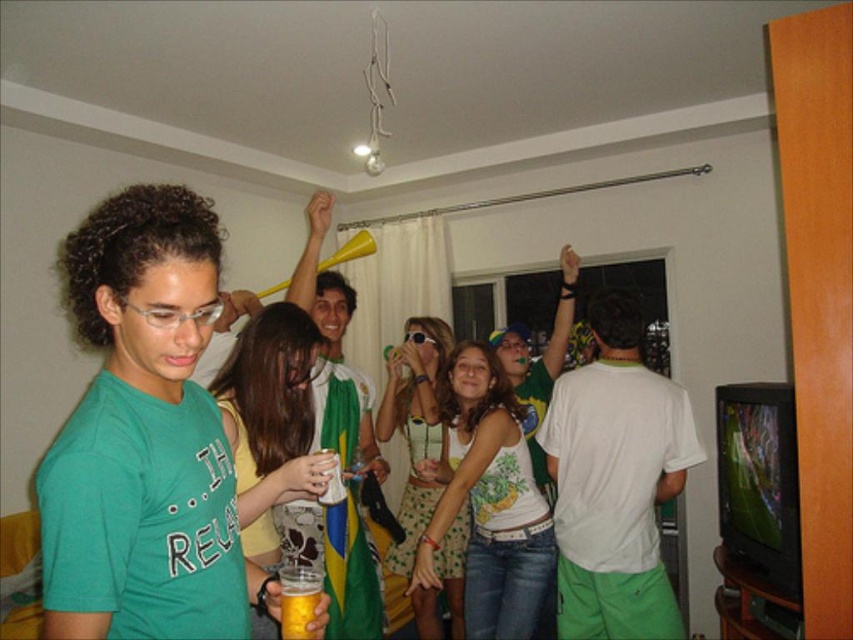
Does white printed tank top at center appear over green polka dot dress at center?

Yes, white printed tank top at center is above green polka dot dress at center.

Between white printed tank top at center and green polka dot dress at center, which one is positioned lower?

green polka dot dress at center is lower down.

Locate an element on the screen. This screenshot has height=640, width=853. white printed tank top at center is located at coordinates (489, 502).

Find the location of a particular element. The image size is (853, 640). white printed tank top at center is located at coordinates (489, 502).

Measure the distance between green polka dot dress at center and camera.

They are 8.58 feet apart.

Can you confirm if green polka dot dress at center is shorter than translucent plastic cup at lower left?

No.

Which is in front, point (380, 408) or point (300, 600)?

Point (300, 600)

Image resolution: width=853 pixels, height=640 pixels. I want to click on green polka dot dress at center, so click(x=415, y=424).

Is point (315, 324) closer to camera compared to point (294, 609)?

That is False.

Is point (242, 360) positioned in front of point (288, 580)?

That is False.

Find the location of a particular element. translucent plastic cup at center is located at coordinates (270, 420).